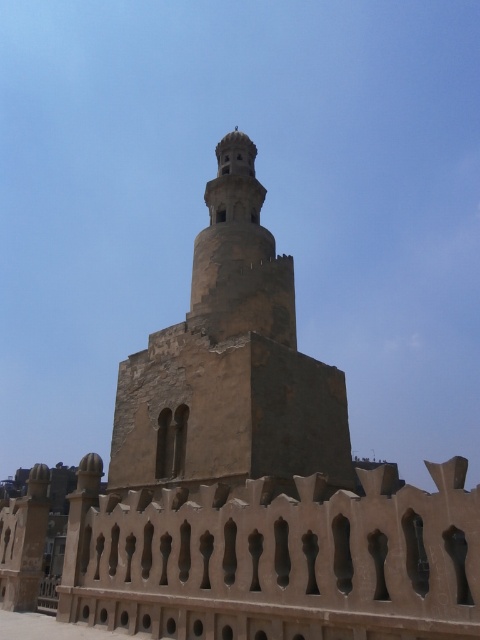
Looking at this image, you are standing in front of the ancient minaret and notice two points marked on its surface. The first point is located at coordinates point (211,579) and the second at point (245,198). Which of these points is nearer to your current position?

Point (211,579) is closer to the viewer than point (245,198).

You are a tourist standing in front of the ancient minaret and notice the brown stone fence at lower center and the brown stone tower at center. Which structure would you estimate is wider in terms of their base measurements?

The brown stone fence at lower center might be wider than brown stone tower at center according to the description.